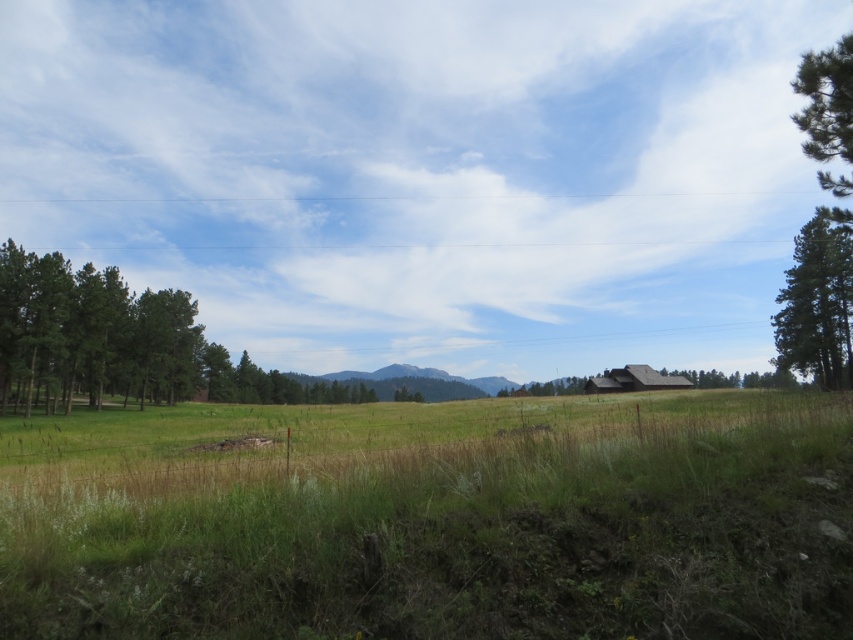
You are standing at the center of the grassy field and want to walk towards the green leafy tree at left. Which direction should you head?

The green leafy tree at left is located at point 0.536 on the x and 0.140 on the y coordinate, so you should head towards the left direction to reach it.

You are a painter standing in the middle of the grassy field. You want to paint the green textured tree at right and the brown wooden hut at lower right. Which object will require a wider brush stroke to capture its full width?

The green textured tree at right requires a wider brush stroke because its width is larger than the brown wooden hut at lower right.

You are a painter setting up your easel in the field. You want to capture both the green textured pine tree at upper right and the brown wooden hut at lower right in your painting. Which object should you position closer to the edge of your canvas to ensure both fit without overcrowding?

The green textured pine tree at upper right might be wider than the brown wooden hut at lower right, so you should position the wider pine tree closer to the edge to provide enough space for both in the painting.